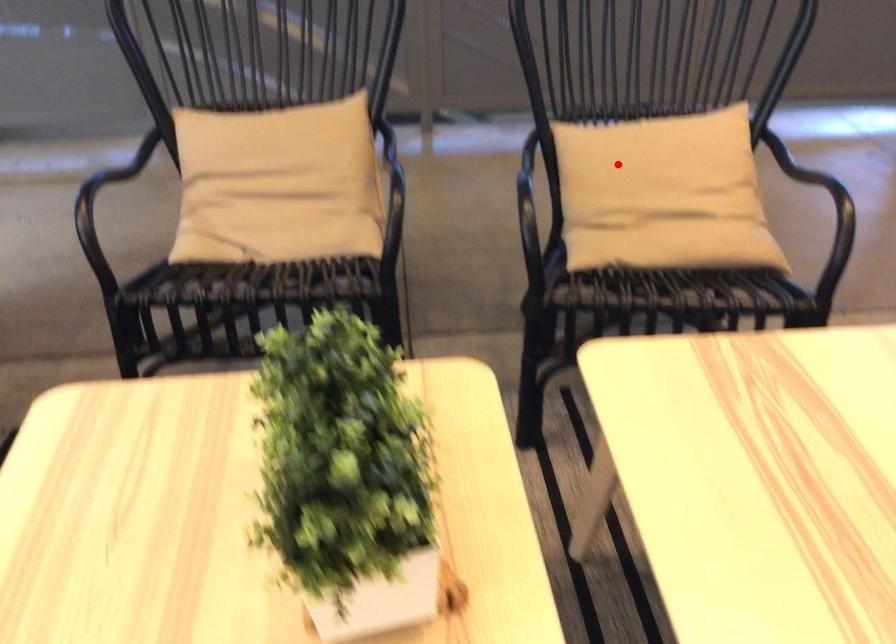
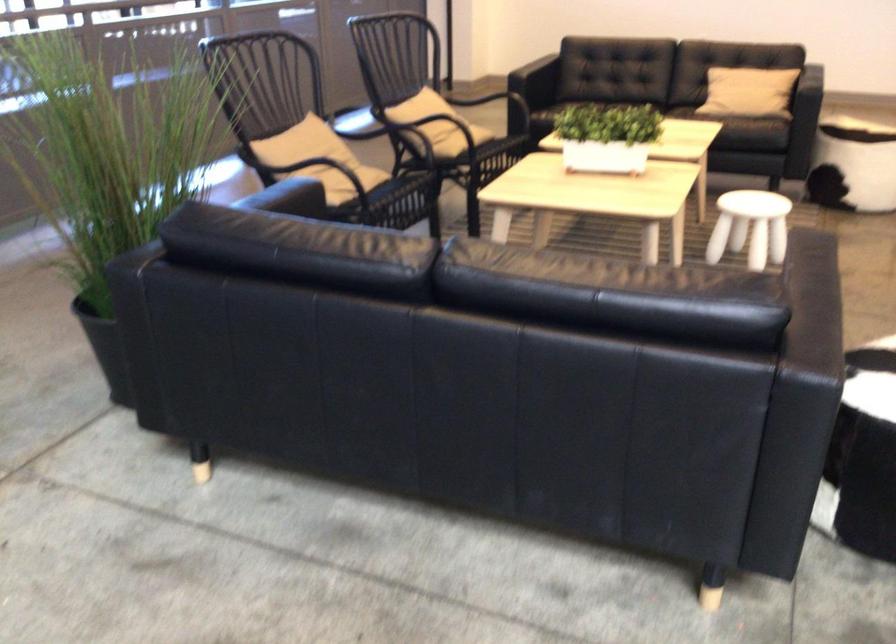
Question: I am providing you with two images of the same scene from different viewpoints. In image1, a red point is highlighted. Considering the same 3D point in image2, which of the following is correct?

Choices:
 (A) It is closer
 (B) It is farther

Answer: (B)